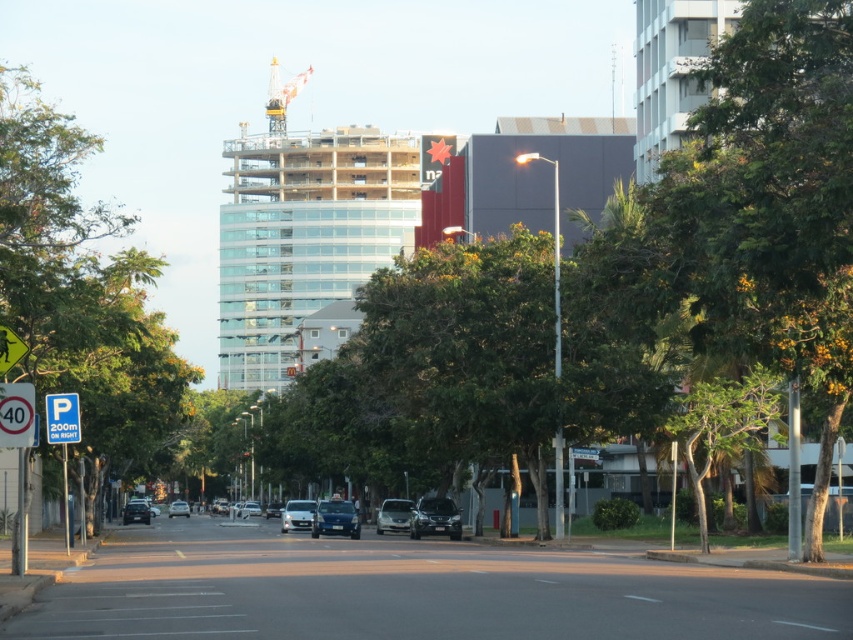
Question: Is green leafy tree at left below satin silver sedan at center?

Choices:
 (A) no
 (B) yes

Answer: (A)

Question: Based on their relative distances, which object is farther from the yellow metallic crane at upper center?

Choices:
 (A) satin black car at center
 (B) green leafy tree at left
 (C) metallic silver sedan at center

Answer: (A)

Question: Can you confirm if yellow plastic speed limit sign at upper left is bigger than yellow reflective plastic traffic sign at left?

Choices:
 (A) yes
 (B) no

Answer: (A)

Question: Among these objects, which one is farthest from the camera?

Choices:
 (A) metallic silver sedan at center
 (B) yellow plastic speed limit sign at upper left

Answer: (A)

Question: Which point is farther to the camera?

Choices:
 (A) (282, 529)
 (B) (0, 65)
 (C) (18, 358)
 (D) (144, 516)

Answer: (B)

Question: Considering the relative positions of satin black car at center and matte black car at center in the image provided, where is satin black car at center located with respect to matte black car at center?

Choices:
 (A) above
 (B) below

Answer: (A)